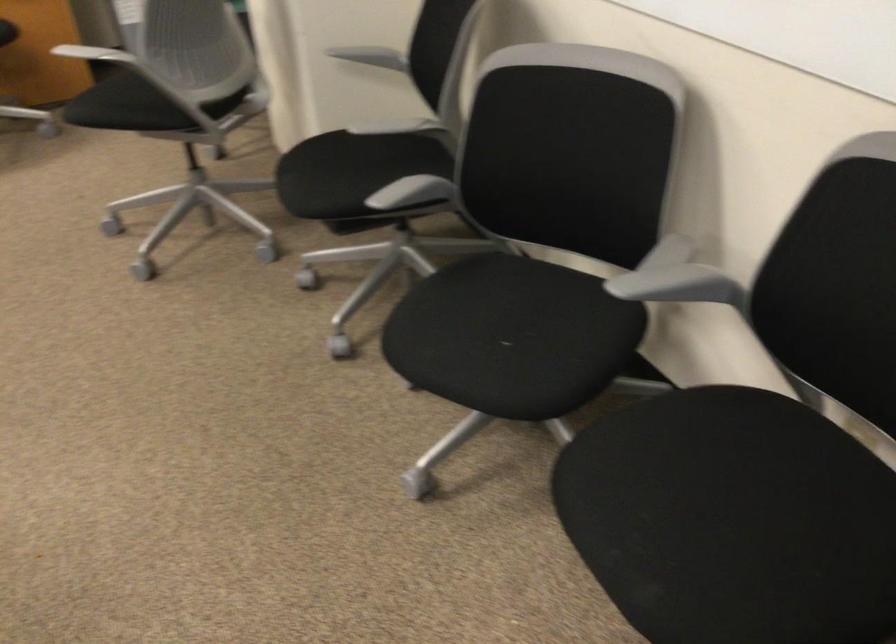
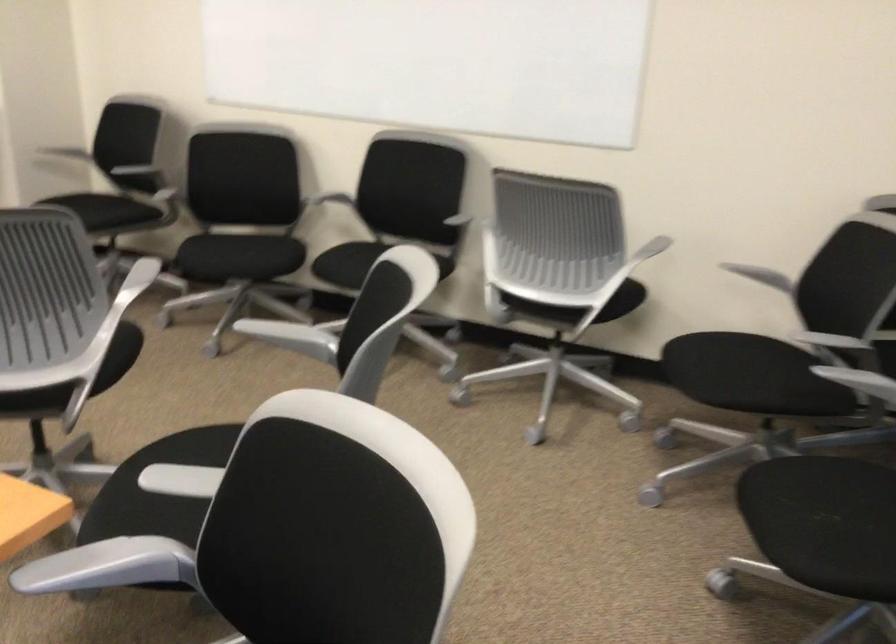
Question: I am providing you with two images of the same scene from different viewpoints. After the viewpoint changes to image2, which objects are now occluded?

Choices:
 (A) white chalk stick
 (B) black chair sitting surface
 (C) silver chair armrest
 (D) grey chair armrest

Answer: (D)